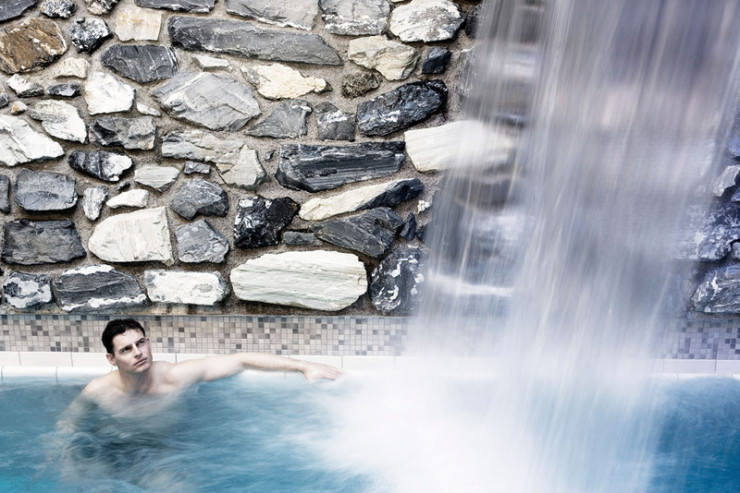
This screenshot has width=740, height=493. Identify the location of small square tile. (50, 334), (198, 330), (323, 332), (394, 337), (693, 346), (729, 345).